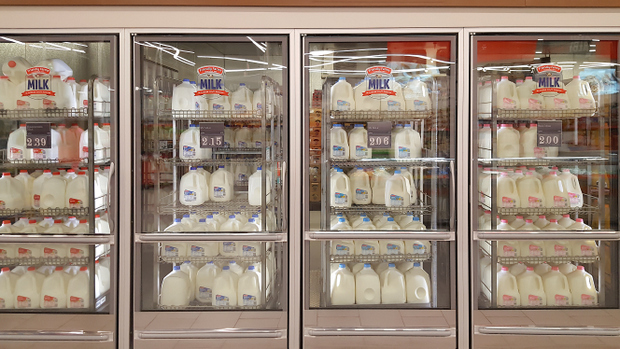
Identify the location of reflective glass doors. (43, 51), (217, 54), (376, 59), (539, 50).